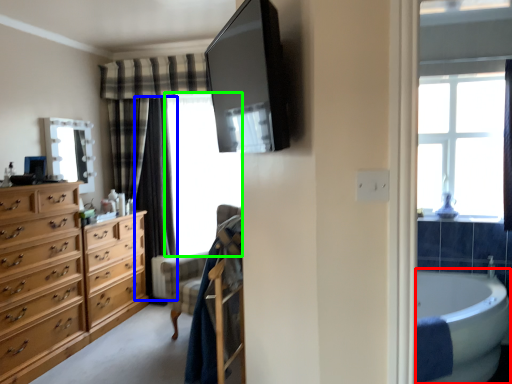
Question: Based on their relative distances, which object is nearer to bath (highlighted by a red box)? Choose from curtain (highlighted by a blue box) and window screen (highlighted by a green box).

Choices:
 (A) curtain
 (B) window screen

Answer: (B)